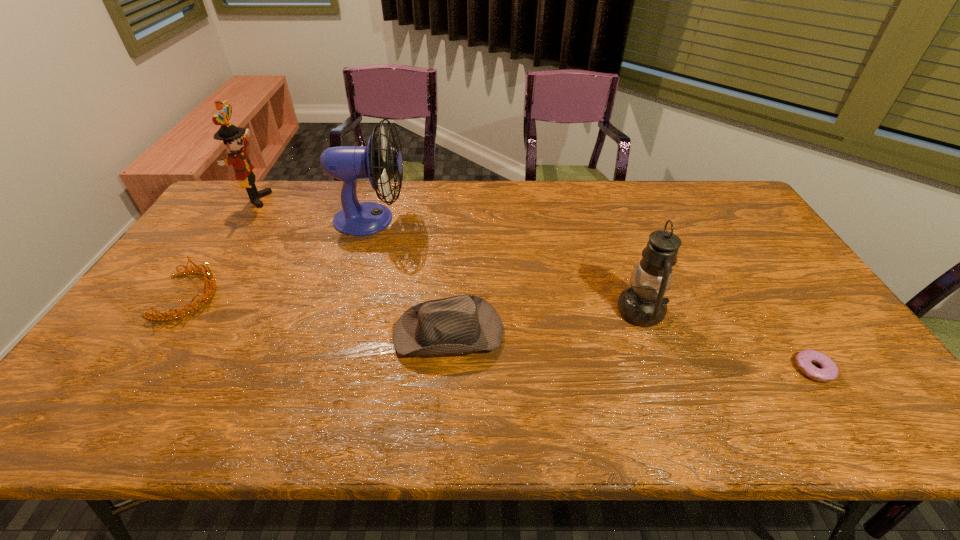
I want to click on vacant area that satisfies the following two spatial constraints: 1. in front of the fedora where the airflow is directed; 2. on the left side of the fan, so click(337, 332).

Identify the location of vacant space that satisfies the following two spatial constraints: 1. on the front-facing side of the tiara; 2. on the left side of the fourth shortest object. This screenshot has width=960, height=540. (178, 311).

I want to click on vacant area in the image that satisfies the following two spatial constraints: 1. in front of the shortest object where the airflow is directed; 2. on the left side of the third object from left to right, so click(325, 369).

Where is `free region that satisfies the following two spatial constraints: 1. on the front-facing side of the fifth tallest object; 2. on the back side of the doughnut`? The image size is (960, 540). free region that satisfies the following two spatial constraints: 1. on the front-facing side of the fifth tallest object; 2. on the back side of the doughnut is located at coordinates (138, 369).

I want to click on free space that satisfies the following two spatial constraints: 1. in front of the fourth shortest object where the airflow is directed; 2. on the right side of the fan, so click(343, 311).

Locate an element on the screen. The height and width of the screenshot is (540, 960). vacant region that satisfies the following two spatial constraints: 1. in front of the fourth object from right to left where the airflow is directed; 2. on the right side of the oil lamp is located at coordinates (343, 311).

At what (x,y) coordinates should I click in order to perform the action: click on free location that satisfies the following two spatial constraints: 1. in front of the fourth object from right to left where the airflow is directed; 2. on the left side of the doughnut. Please return your answer as a coordinate pair (x, y). The width and height of the screenshot is (960, 540). Looking at the image, I should click on (325, 369).

The width and height of the screenshot is (960, 540). I want to click on free region that satisfies the following two spatial constraints: 1. in front of the third object from left to right where the airflow is directed; 2. on the left side of the oil lamp, so click(343, 311).